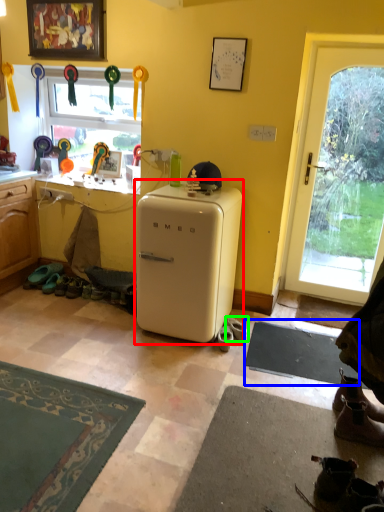
Question: Estimate the real-world distances between objects in this image. Which object is closer to refrigerator (highlighted by a red box), yoga mat (highlighted by a blue box) or footwear (highlighted by a green box)?

Choices:
 (A) yoga mat
 (B) footwear

Answer: (B)